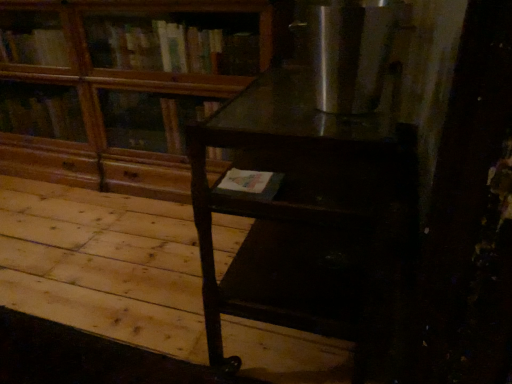
The image size is (512, 384). In order to click on free space in front of wooden at upper left in this screenshot , I will do `click(97, 249)`.